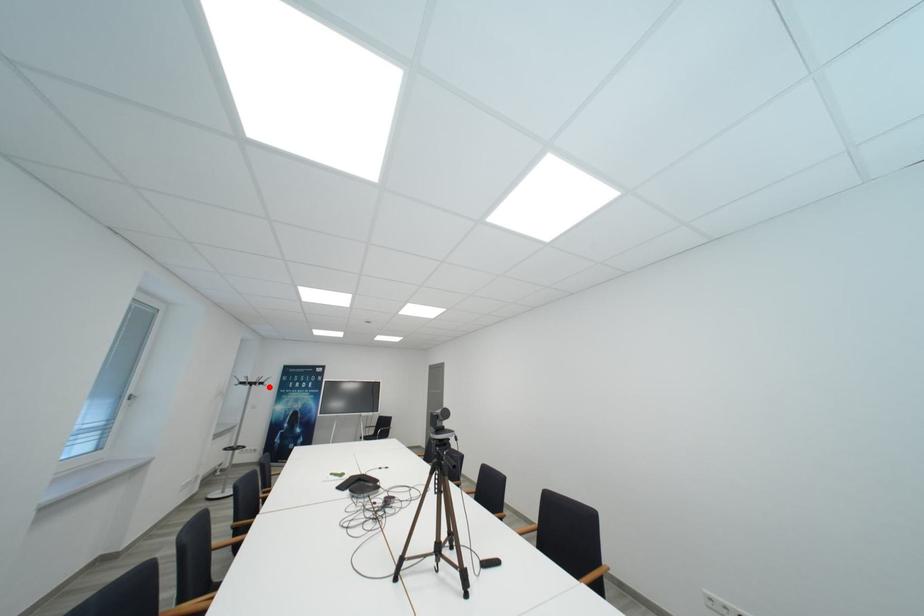
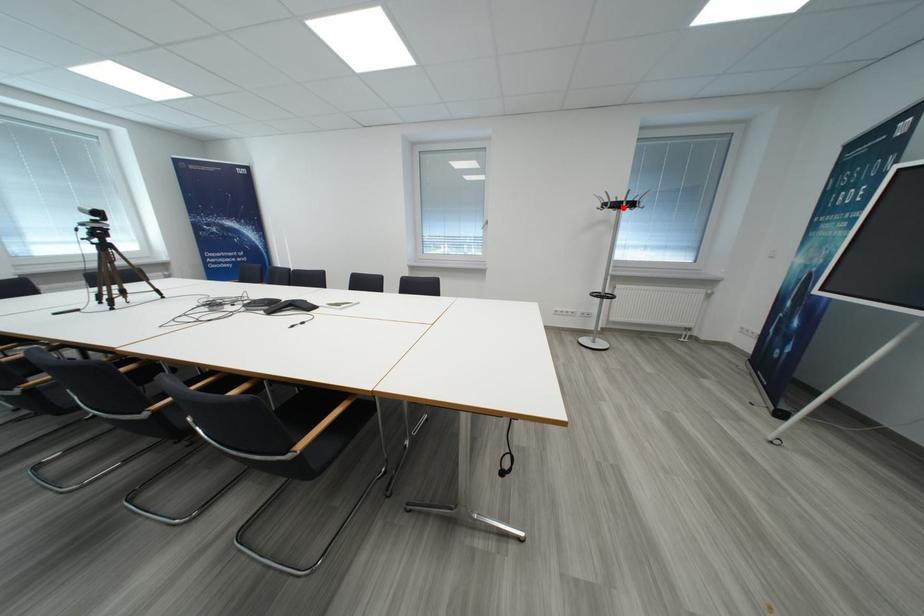
I am providing you with two images of the same scene from different viewpoints. A red point is marked on the first image and another point is marked on the second image. Does the point marked in image1 correspond to the same location as the one in image2?

Yes